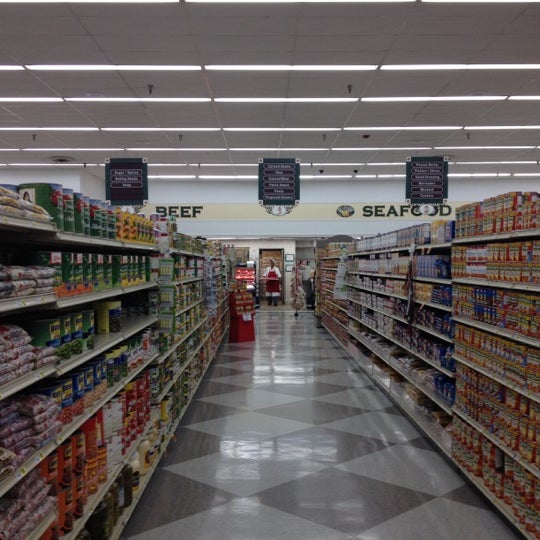
Locate an element on the screen. The image size is (540, 540). sprinkler heads is located at coordinates (148, 84), (33, 135), (180, 138), (349, 86), (322, 138), (468, 134).